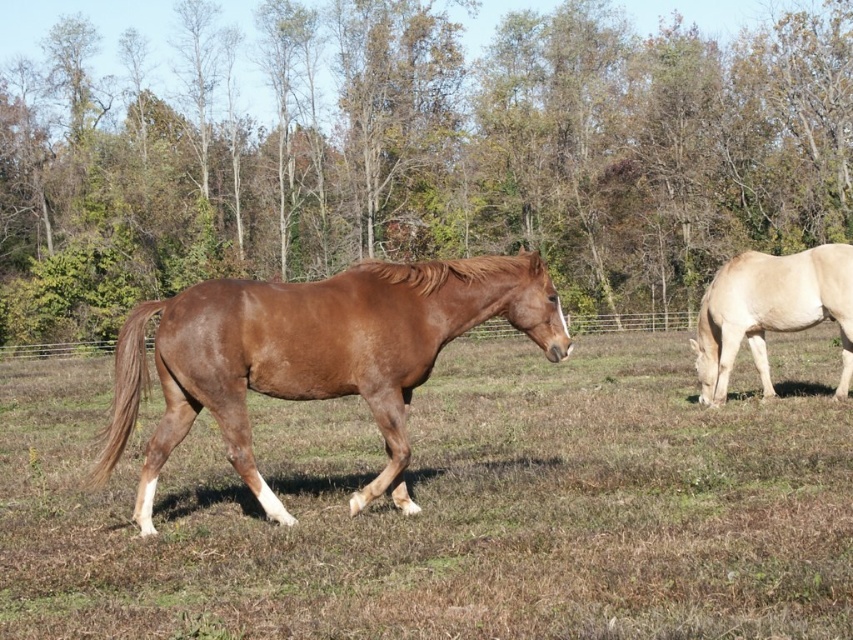
You are a photographer trying to capture both the green leafy tree at center and the brown horse at center in a single frame. Based on their heights, which one should you focus on first to ensure both are in the shot?

The green leafy tree at center is taller than the brown horse at center, so you should focus on the green leafy tree at center first to ensure both are in the shot.

You are a hiker who wants to take a photo of the green leafy tree at center and the brown glossy horse at center. Since you have a camera with a fixed focal length, you need to know which one is bigger in the scene to focus properly. Can you tell me which object is larger in the image?

The green leafy tree at center is larger than the brown glossy horse at center in the image.